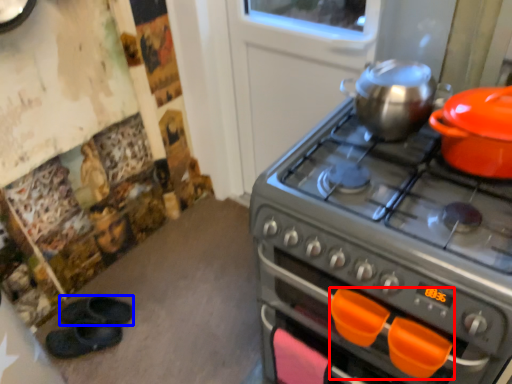
Question: Among these objects, which one is farthest to the camera, handle (highlighted by a red box) or footwear (highlighted by a blue box)?

Choices:
 (A) handle
 (B) footwear

Answer: (B)